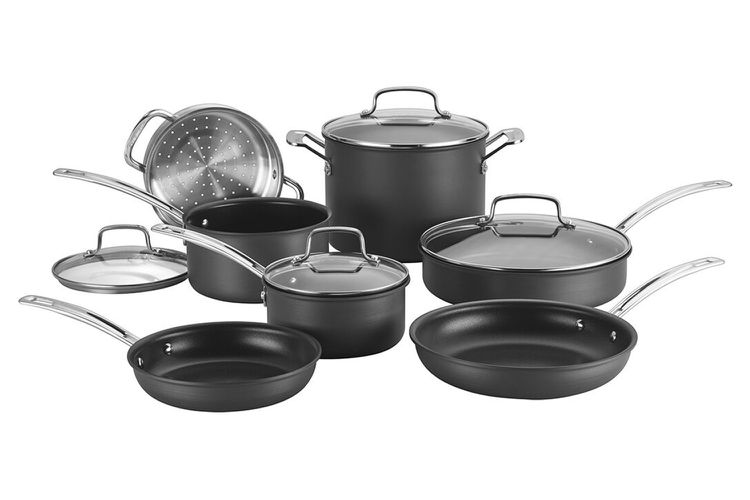
Identify the location of pot set. The image size is (750, 500). (354, 278).